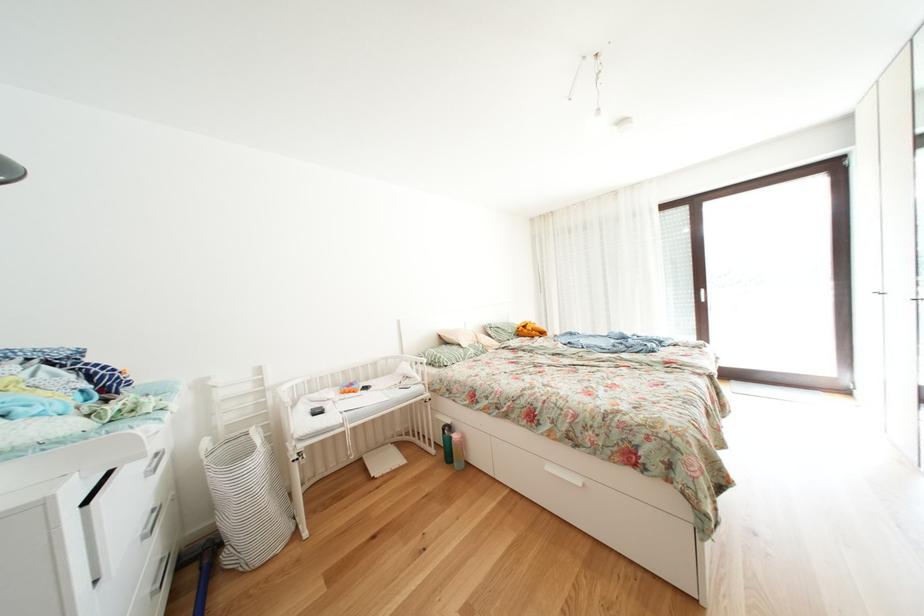
In order to click on green water bottle in this screenshot , I will do `click(446, 443)`.